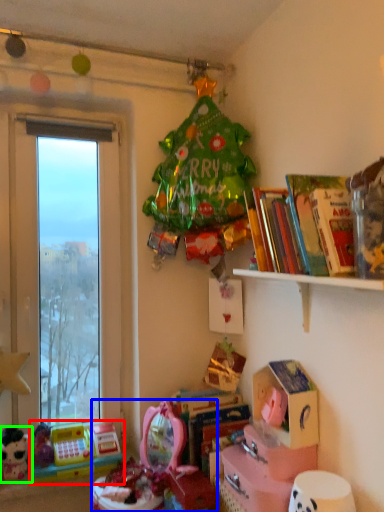
Question: Which object is positioned farthest from toy (highlighted by a red box)? Select from toy (highlighted by a blue box) and toy (highlighted by a green box).

Choices:
 (A) toy
 (B) toy

Answer: (A)